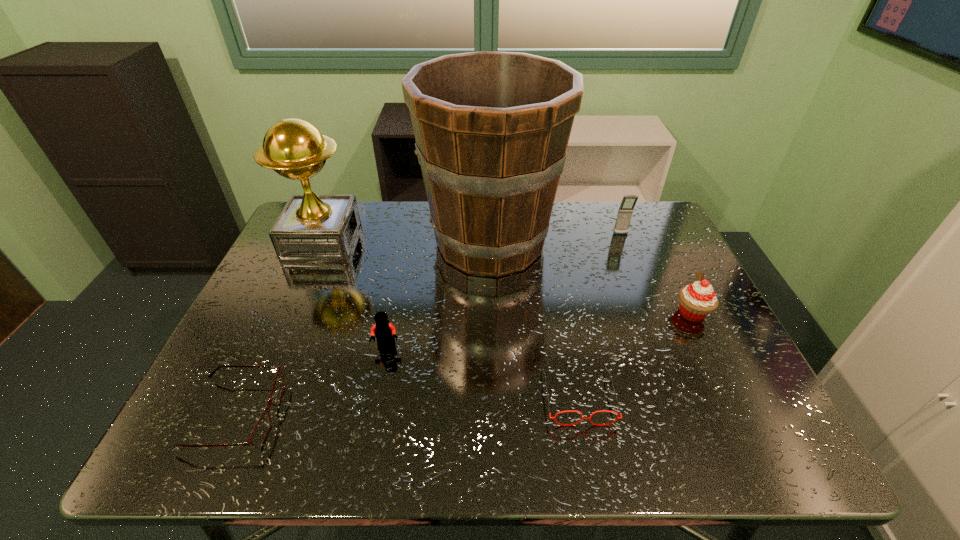
Image resolution: width=960 pixels, height=540 pixels. In order to click on spectacles situated at the left edge in this screenshot , I will do `click(260, 432)`.

I want to click on cellular telephone at the right edge, so click(x=625, y=212).

I want to click on cupcake positioned at the right edge, so pos(697,300).

The width and height of the screenshot is (960, 540). What are the coordinates of `object that is at the far left corner` in the screenshot? It's located at (311, 228).

The width and height of the screenshot is (960, 540). I want to click on object at the near left corner, so click(260, 432).

The width and height of the screenshot is (960, 540). What are the coordinates of `object positioned at the far right corner` in the screenshot? It's located at (625, 212).

Image resolution: width=960 pixels, height=540 pixels. I want to click on blank space at the far edge, so pos(413,220).

Where is `free space at the near edge of the desktop`? free space at the near edge of the desktop is located at coordinates (448, 445).

Where is `vacant space at the left edge`? vacant space at the left edge is located at coordinates (208, 386).

Identify the location of vacant region at the right edge of the desktop. (673, 260).